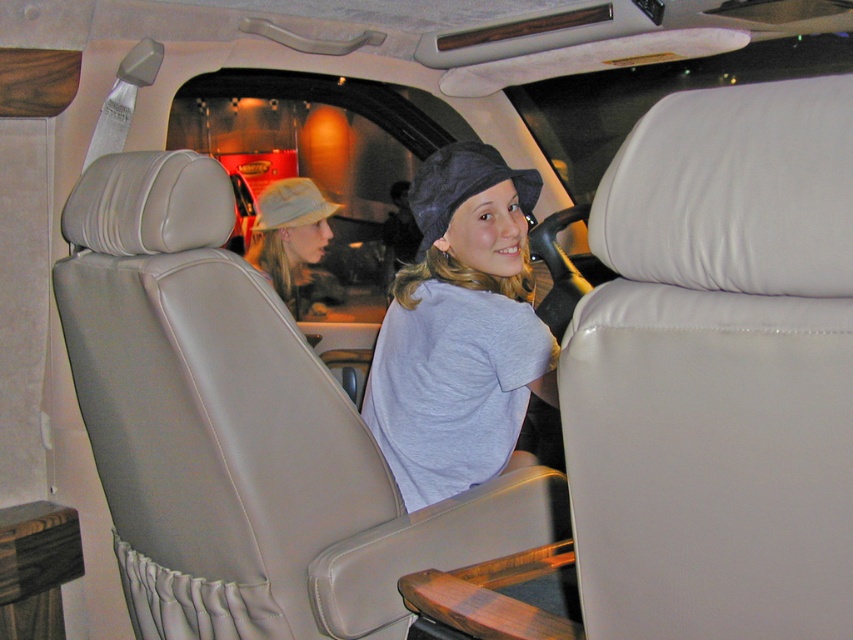
Question: Is matte beige hat at center to the left of khaki fabric baseball hat at center from the viewer's perspective?

Choices:
 (A) no
 (B) yes

Answer: (B)

Question: Among these points, which one is farthest from the camera?

Choices:
 (A) (308, 193)
 (B) (305, 237)
 (C) (529, 323)

Answer: (A)

Question: Which object is farther from the camera taking this photo?

Choices:
 (A) light gray cotton shirt at center
 (B) khaki fabric baseball hat at center
 (C) matte beige hat at center

Answer: (B)

Question: Can you confirm if matte beige hat at center is bigger than dark blue fabric baseball hat at center?

Choices:
 (A) yes
 (B) no

Answer: (A)

Question: Which is nearer to the khaki fabric baseball hat at center?

Choices:
 (A) light gray cotton shirt at center
 (B) dark blue fabric baseball hat at center
 (C) matte beige hat at center

Answer: (C)

Question: Can you confirm if light gray cotton shirt at center is wider than matte beige hat at center?

Choices:
 (A) yes
 (B) no

Answer: (A)